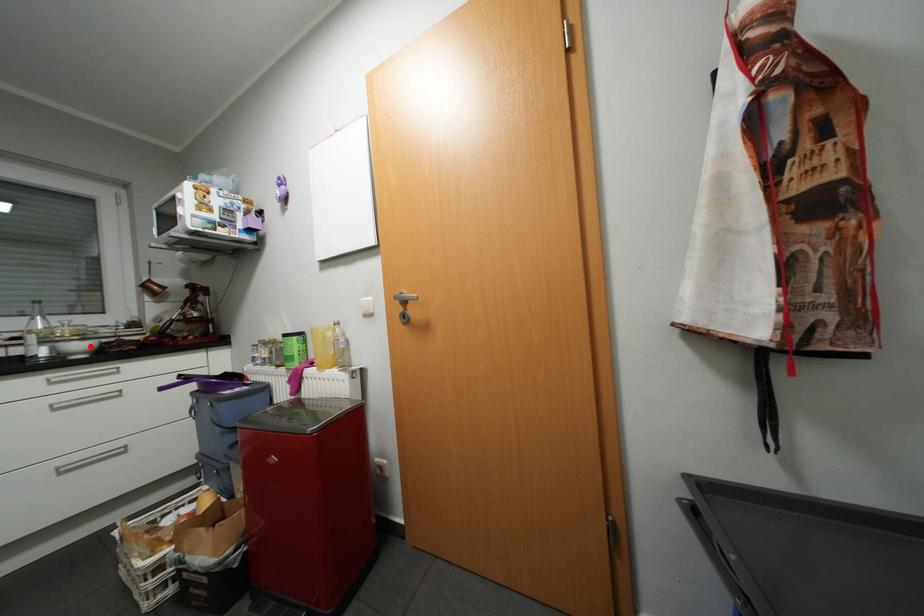
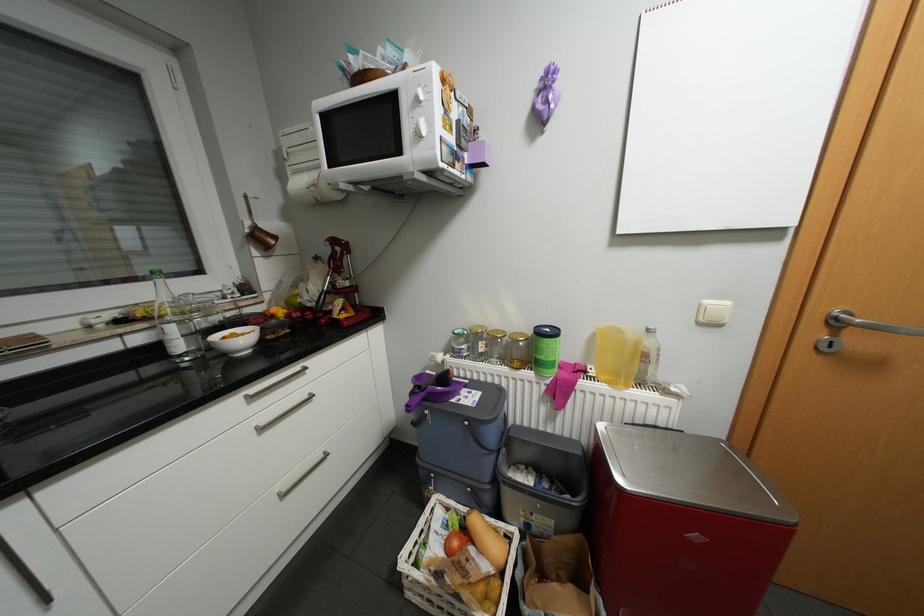
Locate, in the second image, the point that corresponds to the highlighted location in the first image.

(249, 339)